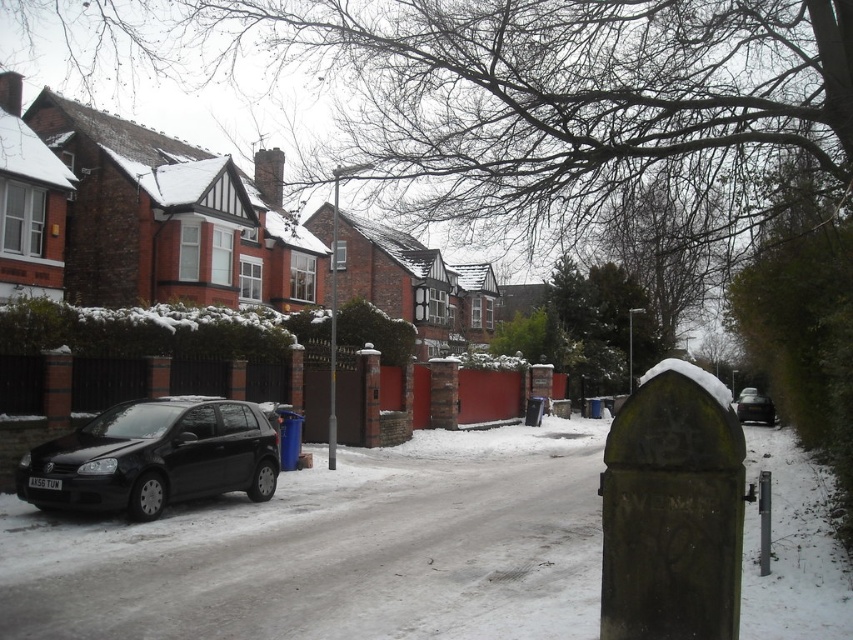
Looking at this image, you are a delivery driver who needs to park your vehicle between the matte black car at lower left and the black matte car at right. Given that your truck is 1.8 meters tall, can you safely park there without hitting the overhead structures?

The matte black car at lower left is taller than the black matte car at right. Since the taller car is already parked there, it implies that there is sufficient clearance for your truck of 1.8 meters to park safely between them as long as there are no other obstructions.

You are a pedestrian standing at the intersection and want to cross the street. There are two cars in your view, a matte black car at lower left and a black matte car at right. Which car is closer to you as you stand at the intersection?

The matte black car at lower left is closer to you because it is positioned in front of the black matte car at right.